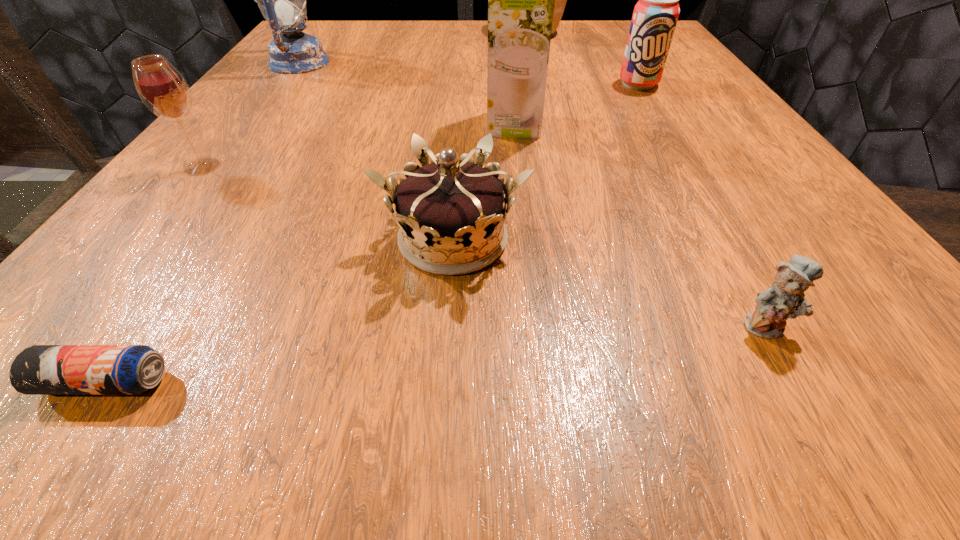
I want to click on empty space that is in between the sixth farthest object and the lantern, so click(x=376, y=151).

You are a GUI agent. You are given a task and a screenshot of the screen. Output one action in this format:
    pyautogui.click(x=<x>, y=<y>)
    Task: Click on the empty space that is in between the shortest object and the fifth nearest object
    
    Given the screenshot: What is the action you would take?
    pyautogui.click(x=309, y=253)

At what (x,y) coordinates should I click in order to perform the action: click on empty location between the soda can and the nearest object. Please return your answer as a coordinate pair (x, y). Looking at the image, I should click on (372, 233).

Locate an element on the screen. The width and height of the screenshot is (960, 540). unoccupied position between the lantern and the pitcher is located at coordinates (419, 47).

Locate an element on the screen. The image size is (960, 540). blank region between the second nearest object and the sixth tallest object is located at coordinates (610, 282).

Image resolution: width=960 pixels, height=540 pixels. In order to click on vacant space that is in between the crown and the second shortest object in this screenshot , I will do `click(610, 282)`.

Identify which object is located as the second nearest to the fifth farthest object. Please provide its 2D coordinates. Your answer should be formatted as a tuple, i.e. [(x, y)], where the tuple contains the x and y coordinates of a point satisfying the conditions above.

[(282, 0)]

Identify which object is the third nearest to the fourth nearest object. Please provide its 2D coordinates. Your answer should be formatted as a tuple, i.e. [(x, y)], where the tuple contains the x and y coordinates of a point satisfying the conditions above.

[(40, 369)]

Find the location of a particular element. The width and height of the screenshot is (960, 540). blank area in the image that satisfies the following two spatial constraints: 1. on the back side of the soda can; 2. on the left side of the shortest object is located at coordinates click(x=304, y=84).